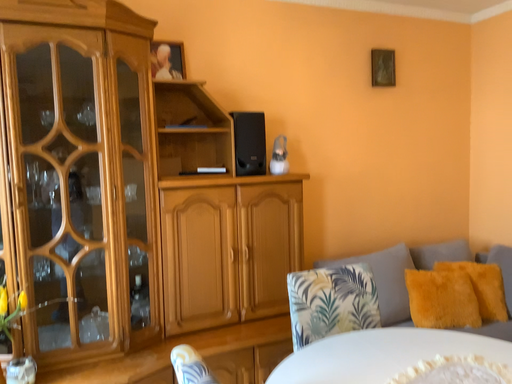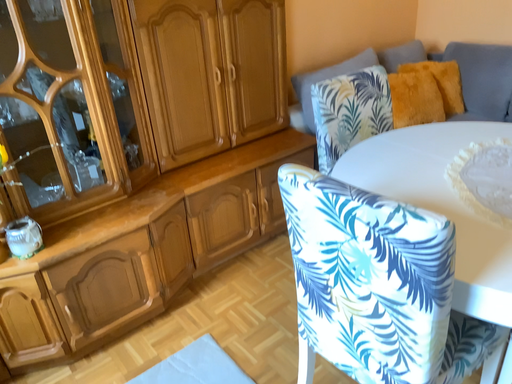
Question: Which way did the camera rotate in the video?

Choices:
 (A) rotated downward
 (B) rotated upward

Answer: (A)